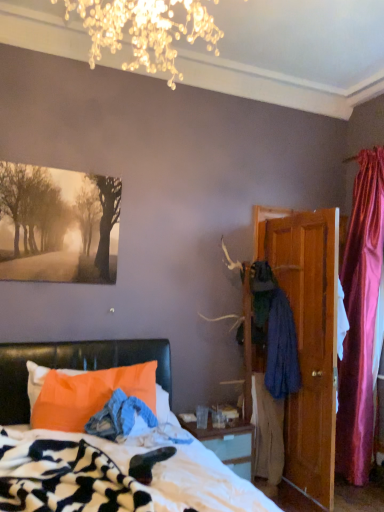
Describe the element at coordinates (58, 225) in the screenshot. I see `matte black painting at upper left` at that location.

Locate an element on the screen. The image size is (384, 512). orange fabric bed at lower left is located at coordinates (75, 368).

Is matte black painting at upper left bigger than wooden door at right?

Incorrect, matte black painting at upper left is not larger than wooden door at right.

Is matte black painting at upper left shorter than wooden door at right?

Indeed, matte black painting at upper left has a lesser height compared to wooden door at right.

Is matte black painting at upper left positioned far away from wooden door at right?

matte black painting at upper left is far away from wooden door at right.

Considering the positions of objects orange fabric pillow at lower left and wooden door at right in the image provided, who is more to the right, orange fabric pillow at lower left or wooden door at right?

From the viewer's perspective, wooden door at right appears more on the right side.

From the image's perspective, which one is positioned lower, orange fabric pillow at lower left or wooden door at right?

orange fabric pillow at lower left appears lower in the image.

Is orange fabric pillow at lower left beside wooden door at right?

They are not placed beside each other.

Does orange fabric pillow at lower left have a smaller size compared to wooden door at right?

Yes.

Between dark blue fabric coat at right and wooden door at right, which one has more height?

wooden door at right is taller.

Can you tell me how much dark blue fabric coat at right and wooden door at right differ in facing direction?

They differ by 0.000424 degrees in their facing directions.

From a real-world perspective, which is physically below, dark blue fabric coat at right or wooden door at right?

dark blue fabric coat at right.

Is dark blue fabric coat at right not within wooden door at right?

Yes.

Identify the location of pillow located on the left of dark blue fabric coat at right. Image resolution: width=384 pixels, height=512 pixels. (88, 394).

Is dark blue fabric coat at right in front of or behind orange fabric pillow at lower left in the image?

Clearly, dark blue fabric coat at right is behind orange fabric pillow at lower left.

Does dark blue fabric coat at right appear on the left side of orange fabric pillow at lower left?

No.

Is wooden door at right at the right side of matte black painting at upper left?

Yes.

Is wooden door at right next to matte black painting at upper left?

wooden door at right and matte black painting at upper left are not in contact.

From a real-world perspective, is wooden door at right below matte black painting at upper left?

Yes, from a real-world perspective, wooden door at right is below matte black painting at upper left.

Does point (318, 210) come farther from viewer compared to point (24, 188)?

That is True.

Is orange fabric pillow at lower left outside of orange fabric bed at lower left?

No, orange fabric pillow at lower left is not outside of orange fabric bed at lower left.

Between orange fabric pillow at lower left and orange fabric bed at lower left, which one has less height?

orange fabric pillow at lower left is shorter.

Is orange fabric pillow at lower left turned away from orange fabric bed at lower left?

Yes, orange fabric pillow at lower left is positioned with its back facing orange fabric bed at lower left.

Relative to orange fabric bed at lower left, is orange fabric pillow at lower left in front or behind?

In the image, orange fabric pillow at lower left appears behind orange fabric bed at lower left.

Considering the sizes of objects wooden door at right and orange fabric bed at lower left in the image provided, who is thinner, wooden door at right or orange fabric bed at lower left?

With smaller width is wooden door at right.

Is wooden door at right not within orange fabric bed at lower left?

wooden door at right is positioned outside orange fabric bed at lower left.

Which of these two, wooden door at right or orange fabric bed at lower left, is bigger?

orange fabric bed at lower left is bigger.

Considering the relative positions of wooden door at right and orange fabric bed at lower left in the image provided, is wooden door at right behind orange fabric bed at lower left?

Yes.

Where is `door on the right of matte black painting at upper left`? door on the right of matte black painting at upper left is located at coordinates (307, 338).

At what (x,y) coordinates should I click in order to perform the action: click on pillow located in front of the wooden door at right. Please return your answer as a coordinate pair (x, y). This screenshot has height=512, width=384. Looking at the image, I should click on pos(88,394).

Consider the image. Which object lies further to the anchor point wooden door at right, dark blue fabric coat at right or orange fabric bed at lower left?

orange fabric bed at lower left lies further to wooden door at right than the other object.

Which object lies further to the anchor point dark blue fabric coat at right, wooden door at right or orange fabric pillow at lower left?

orange fabric pillow at lower left.

Estimate the real-world distances between objects in this image. Which object is closer to orange fabric pillow at lower left, wooden door at right or orange fabric bed at lower left?

orange fabric bed at lower left is positioned closer to the anchor orange fabric pillow at lower left.

Based on their spatial positions, is matte black painting at upper left or dark blue fabric coat at right further from orange fabric pillow at lower left?

dark blue fabric coat at right is positioned further to the anchor orange fabric pillow at lower left.

Estimate the real-world distances between objects in this image. Which object is closer to wooden door at right, orange fabric pillow at lower left or matte black painting at upper left?

Among the two, orange fabric pillow at lower left is located nearer to wooden door at right.

Considering their positions, is dark blue fabric coat at right positioned further to orange fabric pillow at lower left than matte black painting at upper left?

dark blue fabric coat at right is further to orange fabric pillow at lower left.

From the image, which object appears to be nearer to orange fabric bed at lower left, orange fabric pillow at lower left or matte black painting at upper left?

orange fabric pillow at lower left lies closer to orange fabric bed at lower left than the other object.

Looking at the image, which one is located further to orange fabric bed at lower left, wooden door at right or dark blue fabric coat at right?

wooden door at right is further to orange fabric bed at lower left.

This screenshot has width=384, height=512. In order to click on pillow positioned between orange fabric bed at lower left and matte black painting at upper left from near to far in this screenshot , I will do `click(88, 394)`.

At what (x,y) coordinates should I click in order to perform the action: click on picture frame located between orange fabric bed at lower left and wooden door at right in the depth direction. Please return your answer as a coordinate pair (x, y). The width and height of the screenshot is (384, 512). Looking at the image, I should click on (58, 225).

Find the location of a particular element. The image size is (384, 512). pillow situated between matte black painting at upper left and dark blue fabric coat at right from left to right is located at coordinates (88, 394).

Where is `pillow between orange fabric bed at lower left and dark blue fabric coat at right from front to back`? This screenshot has width=384, height=512. pillow between orange fabric bed at lower left and dark blue fabric coat at right from front to back is located at coordinates (88, 394).